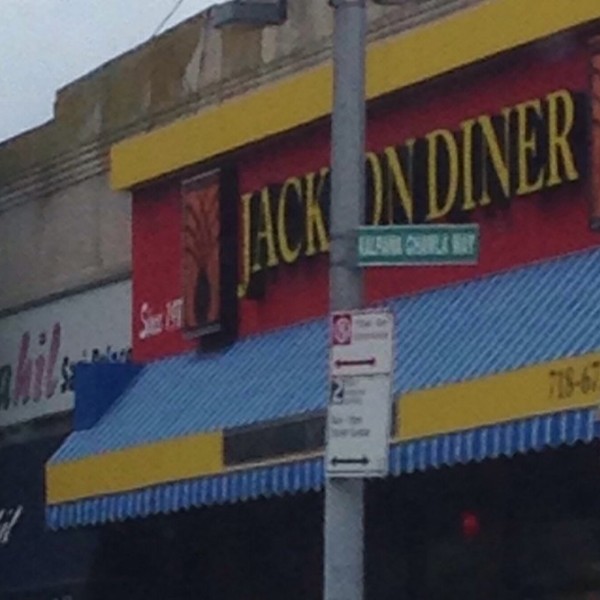
Find the location of a particular element. This screenshot has width=600, height=600. cable is located at coordinates (162, 24).